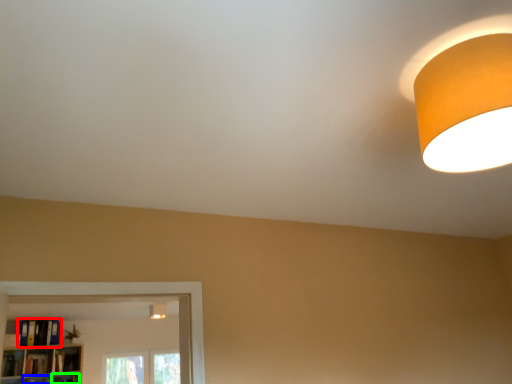
Question: Considering the real-world distances, which object is farthest from book (highlighted by a red box)? shelf (highlighted by a blue box) or shelf (highlighted by a green box)?

Choices:
 (A) shelf
 (B) shelf

Answer: (B)